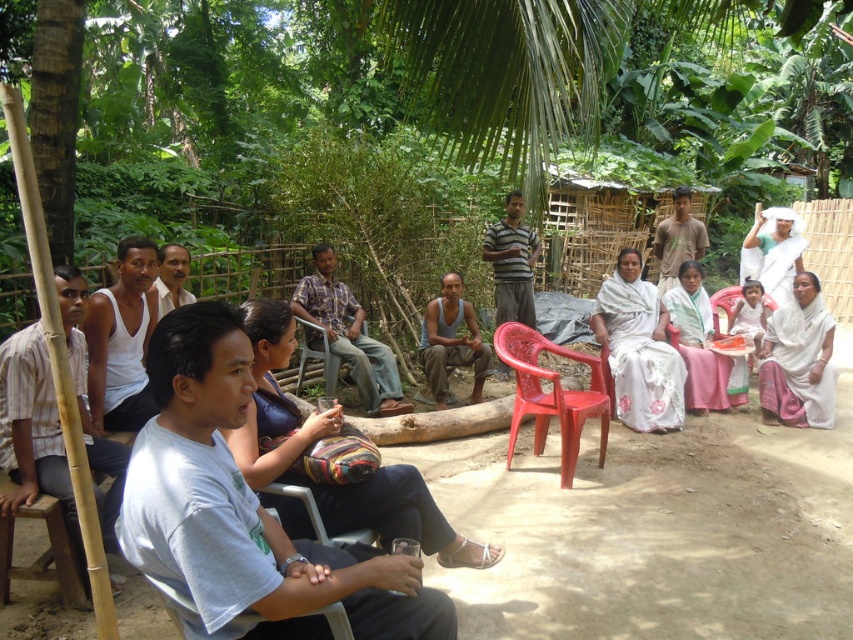
Question: Which point is closer to the camera taking this photo?

Choices:
 (A) (12, 429)
 (B) (682, 198)
 (C) (683, 378)

Answer: (A)

Question: Which of these objects is positioned closest to the white cloth at lower right?

Choices:
 (A) matte gray tank top at center
 (B) green cotton shirt at center

Answer: (B)

Question: Is striped shirt at center to the right of green cotton shirt at center from the viewer's perspective?

Choices:
 (A) yes
 (B) no

Answer: (B)

Question: Is wooden stool at lower left to the right of light brown shirt at center from the viewer's perspective?

Choices:
 (A) yes
 (B) no

Answer: (B)

Question: Estimate the real-world distances between objects in this image. Which object is closer to the light pink fabric at center?

Choices:
 (A) light blue t-shirt at center
 (B) white woven saree at center

Answer: (B)

Question: Can you confirm if multicolored fabric bag at center is positioned below white woven saree at center?

Choices:
 (A) no
 (B) yes

Answer: (B)